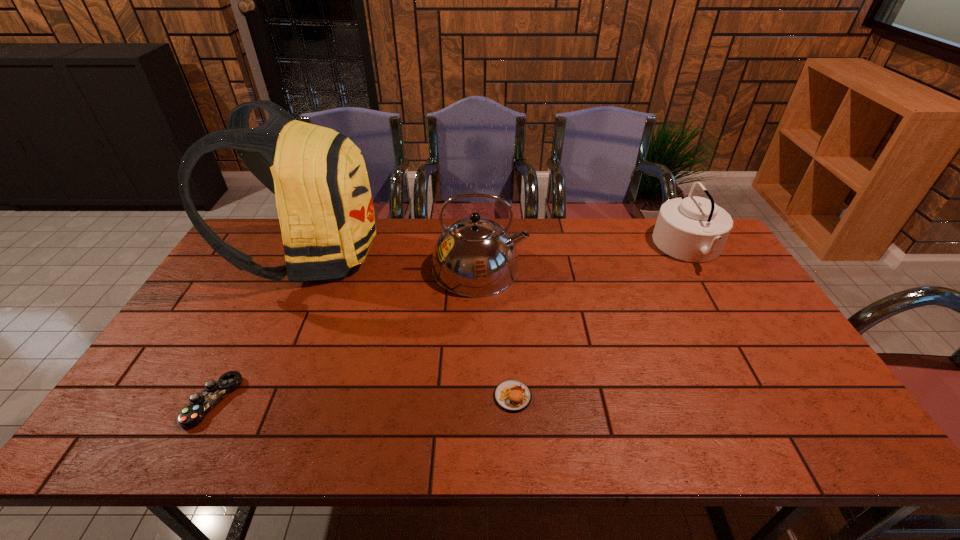
At what (x,y) coordinates should I click in order to perform the action: click on object at the near left corner. Please return your answer as a coordinate pair (x, y). Looking at the image, I should click on (200, 404).

At what (x,y) coordinates should I click in order to perform the action: click on object situated at the far right corner. Please return your answer as a coordinate pair (x, y). Looking at the image, I should click on (694, 229).

Locate an element on the screen. vacant region at the far edge of the desktop is located at coordinates (525, 243).

You are a GUI agent. You are given a task and a screenshot of the screen. Output one action in this format:
    pyautogui.click(x=<x>, y=<y>)
    Task: Click on the free region at the near edge of the desktop
    The height and width of the screenshot is (540, 960).
    Given the screenshot: What is the action you would take?
    pyautogui.click(x=583, y=439)

Locate an element on the screen. The image size is (960, 540). vacant position at the left edge of the desktop is located at coordinates (129, 402).

Where is `vacant area at the right edge of the desktop`? vacant area at the right edge of the desktop is located at coordinates (758, 301).

Where is `free space that is in between the fourth tallest object and the shorter kettle`? This screenshot has height=540, width=960. free space that is in between the fourth tallest object and the shorter kettle is located at coordinates (601, 322).

At what (x,y) coordinates should I click in order to perform the action: click on vacant region between the shortest object and the left kettle. Please return your answer as a coordinate pair (x, y). Looking at the image, I should click on (347, 335).

Identify the location of vacant area that lies between the fourth tallest object and the fourth shortest object. (496, 332).

At what (x,y) coordinates should I click in order to perform the action: click on free space between the fourth tallest object and the control. Please return your answer as a coordinate pair (x, y). The height and width of the screenshot is (540, 960). Looking at the image, I should click on (363, 399).